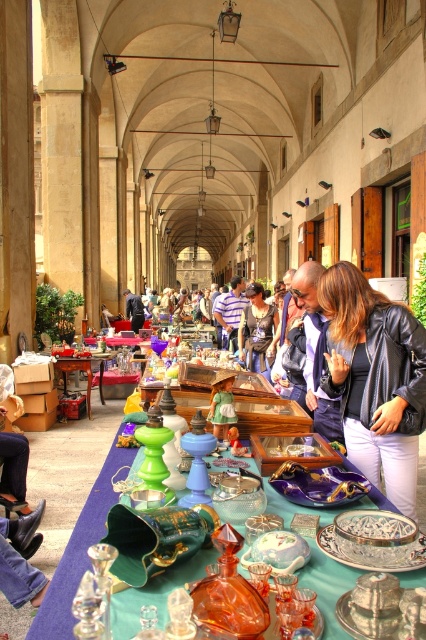
Does matte black jacket at center appear over brushed metal water at bottle left?

No, matte black jacket at center is not above brushed metal water at bottle left.

Is point (271, 337) less distant than point (134, 301)?

Yes.

Identify the location of matte black jacket at center. This screenshot has width=426, height=640. (256, 328).

Where is `matte black jacket at center`? matte black jacket at center is located at coordinates (256, 328).

Who is positioned more to the left, matte black jacket at center or green glass table at center?

green glass table at center is more to the left.

Measure the distance between point (253, 300) and camera.

A distance of 35.28 feet exists between point (253, 300) and camera.

Where is `matte black jacket at center`? The height and width of the screenshot is (640, 426). matte black jacket at center is located at coordinates (256, 328).

Describe the element at coordinates (221, 404) in the screenshot. I see `green fabric dress at center` at that location.

Locate an element on the screen. green fabric dress at center is located at coordinates (221, 404).